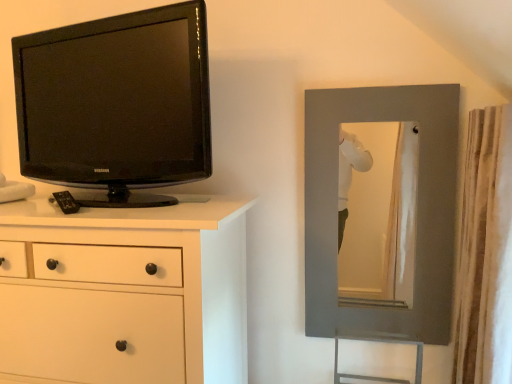
Question: From a real-world perspective, is black glossy tv at left positioned above or below matte gray mirror at right?

Choices:
 (A) below
 (B) above

Answer: (B)

Question: Is black glossy tv at left wider or thinner than matte gray mirror at right?

Choices:
 (A) wide
 (B) thin

Answer: (A)

Question: Which object is positioned farthest from the white textured curtain at right?

Choices:
 (A) black glossy tv at left
 (B) matte gray mirror at right
 (C) white matte chest of drawers at left

Answer: (A)

Question: Which is farther from the matte gray mirror at right?

Choices:
 (A) white textured curtain at right
 (B) white matte chest of drawers at left
 (C) black glossy tv at left

Answer: (C)